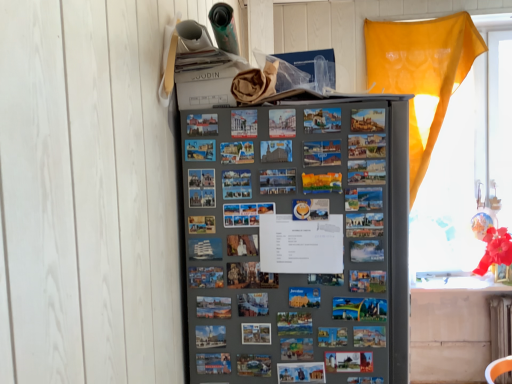
Question: Could you tell me if translucent yellow curtain at right is facing white painted metal radiator at lower right?

Choices:
 (A) yes
 (B) no

Answer: (B)

Question: Can you confirm if translucent yellow curtain at right is positioned to the right of white painted metal radiator at lower right?

Choices:
 (A) yes
 (B) no

Answer: (B)

Question: From the image's perspective, is translucent yellow curtain at right located above white painted metal radiator at lower right?

Choices:
 (A) no
 (B) yes

Answer: (B)

Question: Is white painted metal radiator at lower right surrounded by translucent yellow curtain at right?

Choices:
 (A) no
 (B) yes

Answer: (A)

Question: Is translucent yellow curtain at right not inside white painted metal radiator at lower right?

Choices:
 (A) no
 (B) yes

Answer: (B)

Question: In terms of height, does translucent yellow curtain at right look taller or shorter compared to metallic gray refrigerator at center?

Choices:
 (A) short
 (B) tall

Answer: (B)

Question: Would you say translucent yellow curtain at right is to the left or to the right of metallic gray refrigerator at center in the picture?

Choices:
 (A) left
 (B) right

Answer: (B)

Question: In terms of width, does translucent yellow curtain at right look wider or thinner when compared to metallic gray refrigerator at center?

Choices:
 (A) thin
 (B) wide

Answer: (A)

Question: From a real-world perspective, is translucent yellow curtain at right physically located above or below metallic gray refrigerator at center?

Choices:
 (A) above
 (B) below

Answer: (A)

Question: Does point (395, 175) appear closer or farther from the camera than point (441, 211)?

Choices:
 (A) farther
 (B) closer

Answer: (B)

Question: From the image's perspective, is metallic gray refrigerator at center above or below translucent yellow curtain at right?

Choices:
 (A) above
 (B) below

Answer: (B)

Question: Is metallic gray refrigerator at center taller or shorter than translucent yellow curtain at right?

Choices:
 (A) short
 (B) tall

Answer: (A)

Question: From a real-world perspective, is metallic gray refrigerator at center positioned above or below translucent yellow curtain at right?

Choices:
 (A) above
 (B) below

Answer: (B)

Question: Considering their positions, is translucent yellow curtain at right located in front of or behind white painted metal radiator at lower right?

Choices:
 (A) front
 (B) behind

Answer: (B)

Question: Is translucent yellow curtain at right spatially inside white painted metal radiator at lower right, or outside of it?

Choices:
 (A) inside
 (B) outside

Answer: (B)